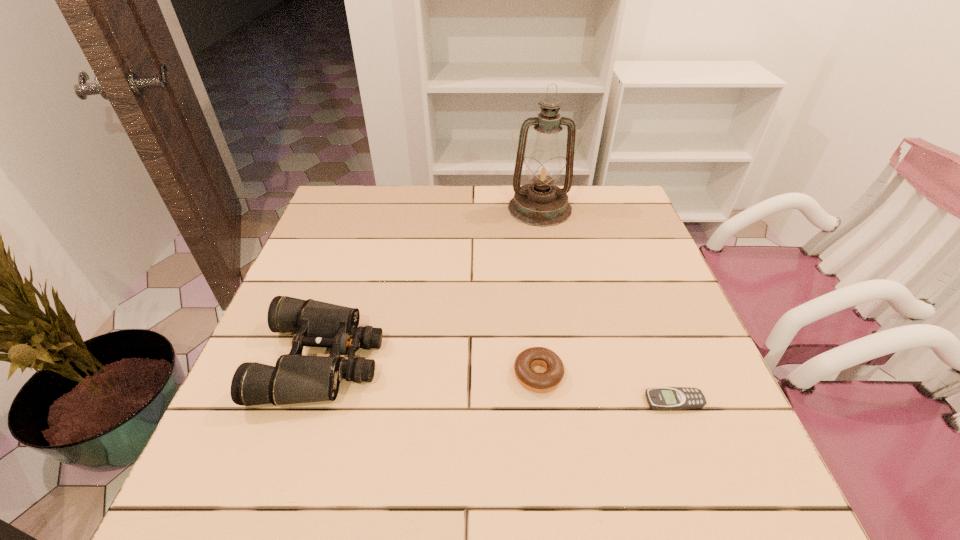
Identify the location of vacant space that satisfies the following two spatial constraints: 1. through the eyepieces of the third tallest object; 2. on the left side of the leftmost object. This screenshot has width=960, height=540. (318, 374).